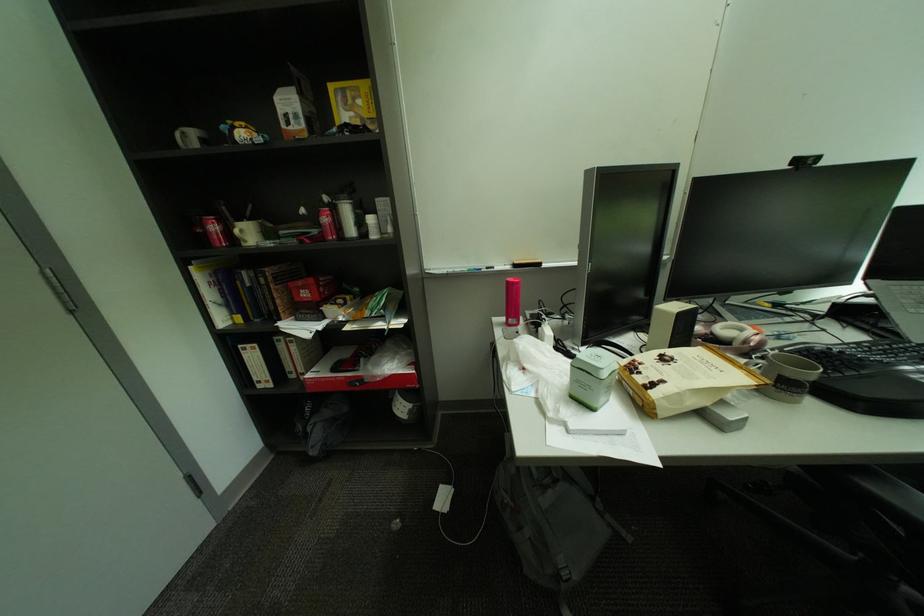
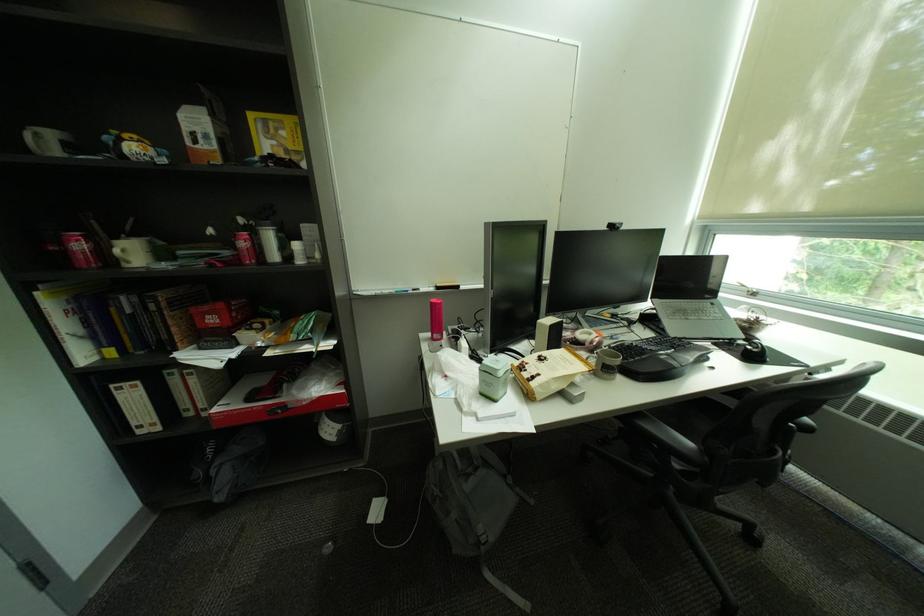
Locate, in the second image, the point that corresponds to pixel 584 399 in the first image.

(492, 395)